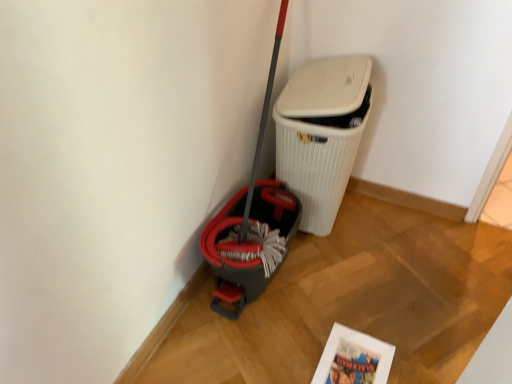
Identify the location of vacant space underneath matte white comic book at lower center (from a real-world perspective). The height and width of the screenshot is (384, 512). (353, 358).